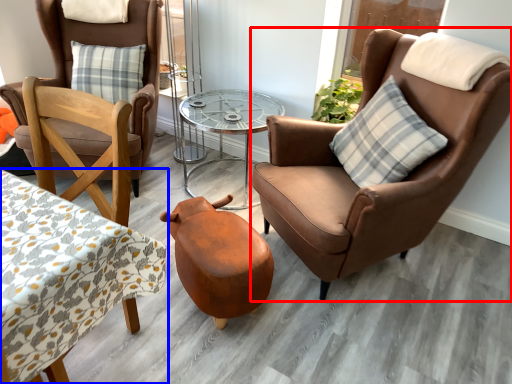
Question: Which point is further to the camera, chair (highlighted by a red box) or coffee table (highlighted by a blue box)?

Choices:
 (A) chair
 (B) coffee table

Answer: (A)